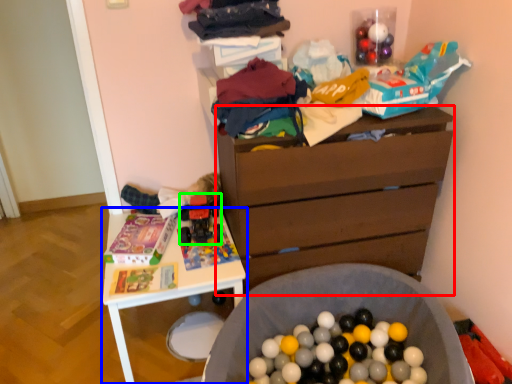
Question: Estimate the real-world distances between objects in this image. Which object is farther from chest of drawers (highlighted by a red box), table (highlighted by a blue box) or toy (highlighted by a green box)?

Choices:
 (A) table
 (B) toy

Answer: (B)